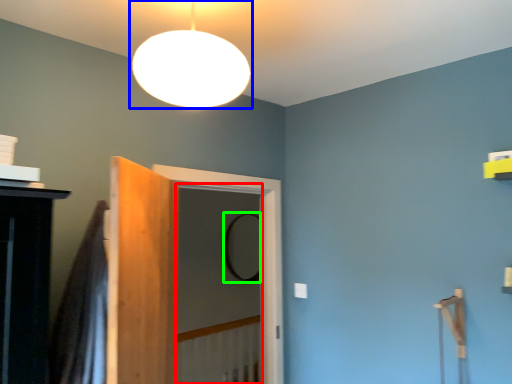
Question: Which is nearer to the screen door (highlighted by a red box)? lamp (highlighted by a blue box) or mirror (highlighted by a green box).

Choices:
 (A) lamp
 (B) mirror

Answer: (B)